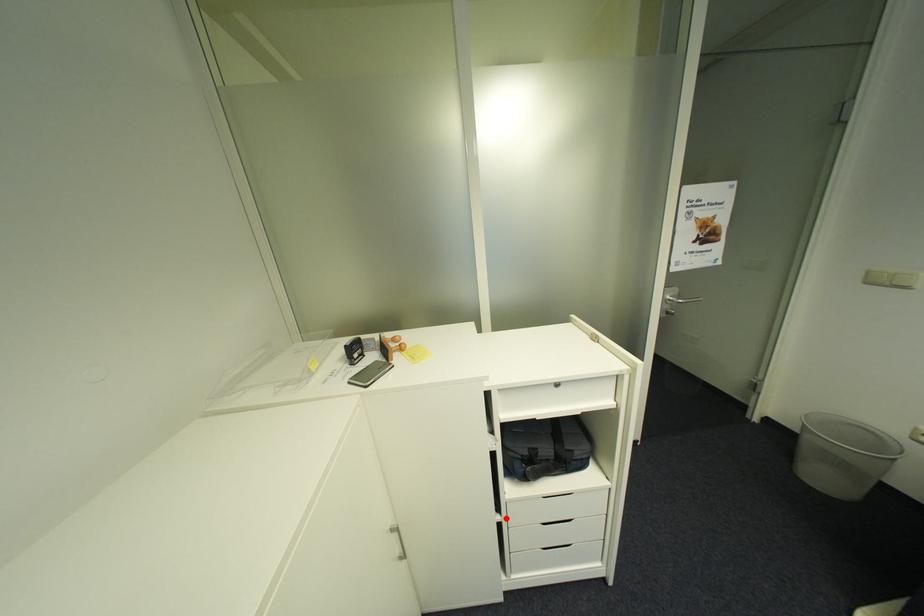
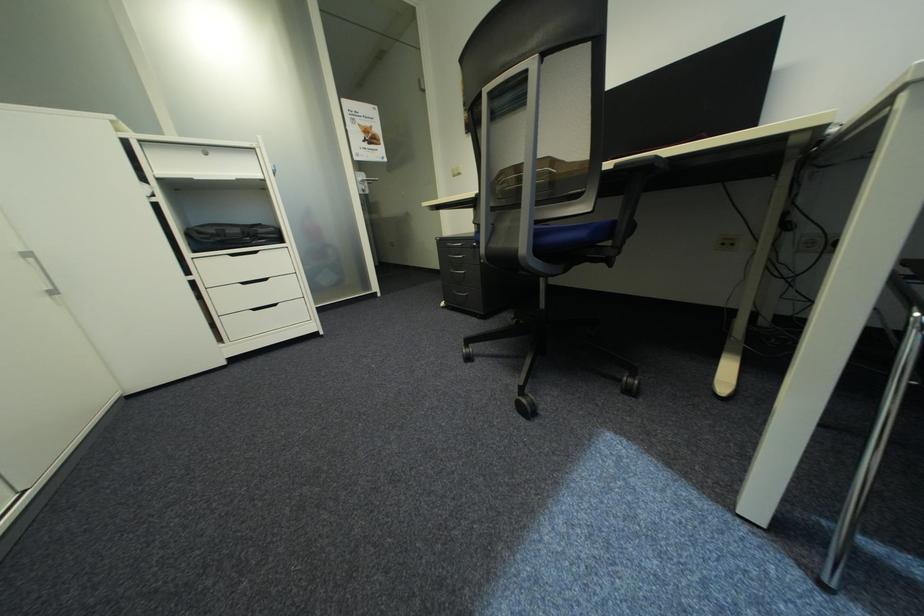
Question: I am providing you with two images of the same scene from different viewpoints. A red point is marked on the first image. At the location where the point appears in image 1, is it still visible in image 2?

Choices:
 (A) Yes
 (B) No

Answer: (A)